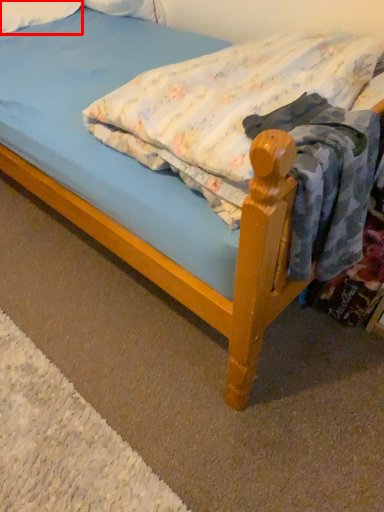
Question: From the image's perspective, where is pillow (annotated by the red box) located relative to mattress?

Choices:
 (A) above
 (B) below

Answer: (A)